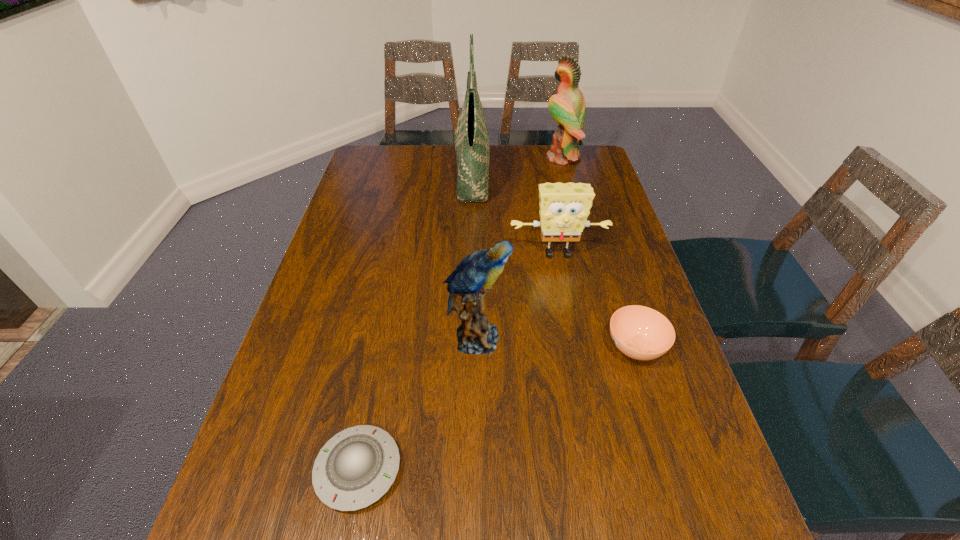
Where is `free space that is in between the leftmost object and the nearer parrot`? free space that is in between the leftmost object and the nearer parrot is located at coordinates (418, 404).

Where is `blank region between the second shortest object and the fourth nearest object`? The width and height of the screenshot is (960, 540). blank region between the second shortest object and the fourth nearest object is located at coordinates (596, 300).

Locate an element on the screen. This screenshot has height=540, width=960. free spot between the soup bowl and the fourth shortest object is located at coordinates (556, 343).

You are a GUI agent. You are given a task and a screenshot of the screen. Output one action in this format:
    pyautogui.click(x=<x>, y=<y>)
    Task: Click on the free area in between the saucer and the soup bowl
    This screenshot has width=960, height=540.
    Given the screenshot: What is the action you would take?
    pyautogui.click(x=496, y=408)

I want to click on vacant space that's between the saucer and the second shortest object, so click(x=496, y=408).

Locate an element on the screen. vacant space that's between the second shortest object and the saucer is located at coordinates 496,408.

Locate an element on the screen. The width and height of the screenshot is (960, 540). vacant region between the soup bowl and the shorter parrot is located at coordinates (556, 343).

Identify which object is the third nearest to the tote bag. Please provide its 2D coordinates. Your answer should be formatted as a tuple, i.e. [(x, y)], where the tuple contains the x and y coordinates of a point satisfying the conditions above.

[(474, 275)]

Identify the location of the fifth closest object to the sponge. (355, 468).

The image size is (960, 540). I want to click on vacant area that satisfies the following two spatial constraints: 1. on the face of the soup bowl; 2. on the right side of the left parrot, so click(476, 347).